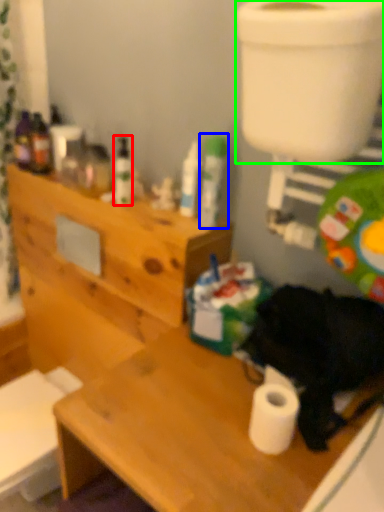
Question: Which object is positioned farthest from toiletry (highlighted by a red box)? Select from toiletry (highlighted by a blue box) and toilet bowl (highlighted by a green box).

Choices:
 (A) toiletry
 (B) toilet bowl

Answer: (B)